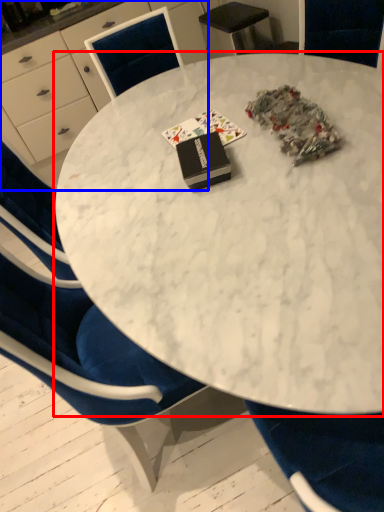
Question: Which object appears closest to the camera in this image, table (highlighted by a red box) or desk (highlighted by a blue box)?

Choices:
 (A) table
 (B) desk

Answer: (A)